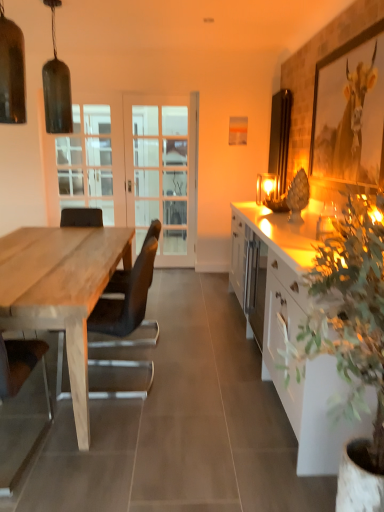
Question: Which direction should I rotate to look at clear glass door at center, which ranks as the 2th screen door in right-to-left order, — up or down?

Choices:
 (A) up
 (B) down

Answer: (A)

Question: Considering the relative sizes of natural wood table at left and white glossy cabinet at right in the image provided, is natural wood table at left wider than white glossy cabinet at right?

Choices:
 (A) yes
 (B) no

Answer: (A)

Question: Is natural wood table at left bigger than white glossy cabinet at right?

Choices:
 (A) yes
 (B) no

Answer: (A)

Question: Is natural wood table at left taller than white glossy cabinet at right?

Choices:
 (A) no
 (B) yes

Answer: (A)

Question: From the image's perspective, does natural wood table at left appear lower than white glossy cabinet at right?

Choices:
 (A) no
 (B) yes

Answer: (A)

Question: Is natural wood table at left shorter than white glossy cabinet at right?

Choices:
 (A) yes
 (B) no

Answer: (A)

Question: Considering the relative positions of natural wood table at left and white glossy cabinet at right in the image provided, is natural wood table at left behind white glossy cabinet at right?

Choices:
 (A) no
 (B) yes

Answer: (B)

Question: From a real-world perspective, is matte glass pendant light at upper left, positioned as the 3th lamp in back-to-front order, over brown leather chair at left, acting as the first chair starting from the front?

Choices:
 (A) yes
 (B) no

Answer: (A)

Question: Is brown leather chair at left, placed as the second chair when sorted from right to left, inside matte glass pendant light at upper left, which is counted as the 2th lamp, starting from the right?

Choices:
 (A) yes
 (B) no

Answer: (B)

Question: From a real-world perspective, is matte glass pendant light at upper left, positioned as the 3th lamp in back-to-front order, below brown leather chair at left, which is the first chair from left to right?

Choices:
 (A) yes
 (B) no

Answer: (B)

Question: Is the position of matte glass pendant light at upper left, placed as the 1th lamp when sorted from front to back, more distant than that of brown leather chair at left, arranged as the second chair when viewed from the back?

Choices:
 (A) yes
 (B) no

Answer: (A)

Question: Is matte glass pendant light at upper left, which is counted as the 2th lamp, starting from the right, with brown leather chair at left, which is the first chair from left to right?

Choices:
 (A) no
 (B) yes

Answer: (A)

Question: Is matte glass pendant light at upper left, positioned as the 3th lamp in back-to-front order, closer to camera compared to brown leather chair at left, arranged as the second chair when viewed from the back?

Choices:
 (A) no
 (B) yes

Answer: (A)

Question: From a real-world perspective, is matte glass lamp at upper right, the first lamp in the back-to-front sequence, under white glass screen door at center, which is the second screen door in left-to-right order?

Choices:
 (A) yes
 (B) no

Answer: (B)